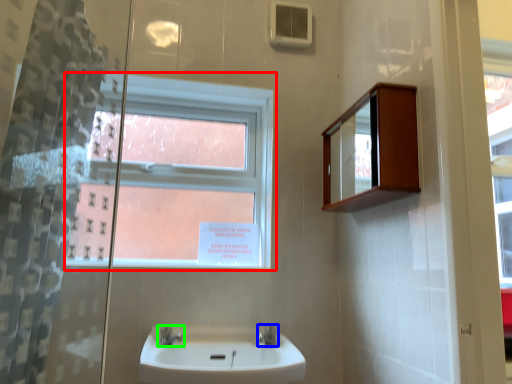
Question: Which object is positioned farthest from window (highlighted by a red box)? Select from tap (highlighted by a blue box) and tap (highlighted by a green box).

Choices:
 (A) tap
 (B) tap

Answer: (A)